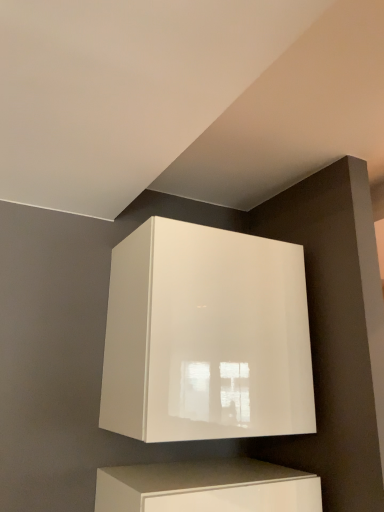
Image resolution: width=384 pixels, height=512 pixels. Describe the element at coordinates (206, 336) in the screenshot. I see `glossy white cabinet at upper center` at that location.

You are a GUI agent. You are given a task and a screenshot of the screen. Output one action in this format:
    pyautogui.click(x=<x>, y=<y>)
    Task: Click on the glossy white cabinet at upper center
    Image resolution: width=384 pixels, height=512 pixels.
    Given the screenshot: What is the action you would take?
    pyautogui.click(x=206, y=336)

I want to click on glossy white cabinet at upper center, so click(x=206, y=336).